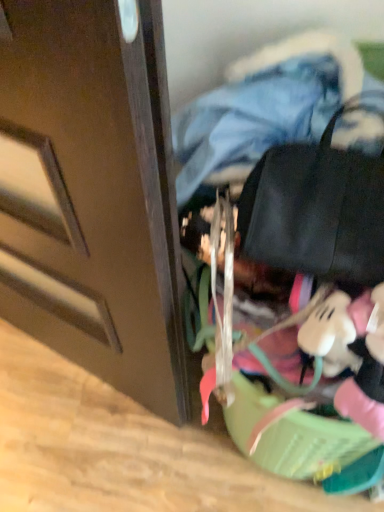
Identify the location of blank space situated above black leather messenger bag at upper right (from a real-world perspective). The width and height of the screenshot is (384, 512). (337, 154).